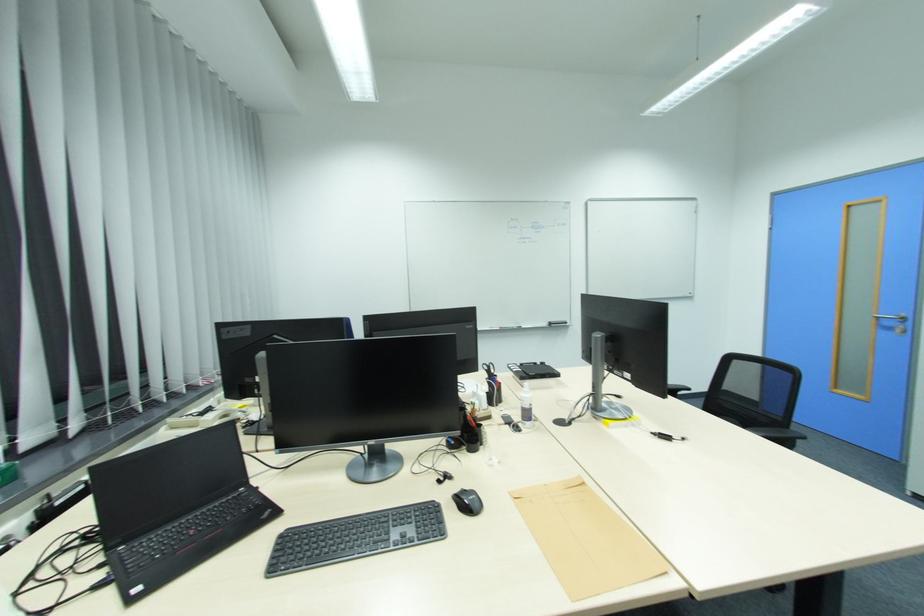
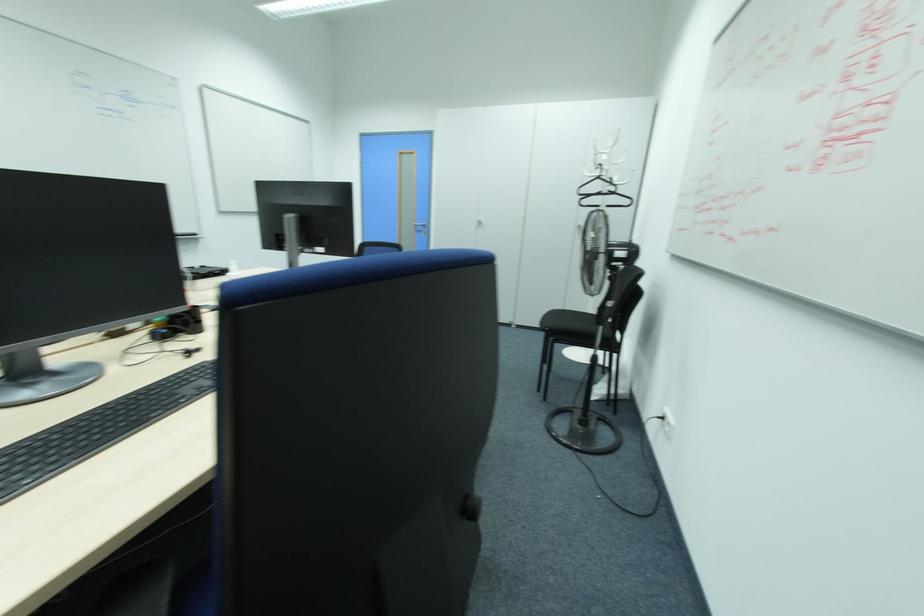
Question: The camera is either moving clockwise (left) or counter-clockwise (right) around the object. The first image is from the beginning of the video and the second image is from the end. Is the camera moving left or right when shooting the video?

Choices:
 (A) Left
 (B) Right

Answer: (A)